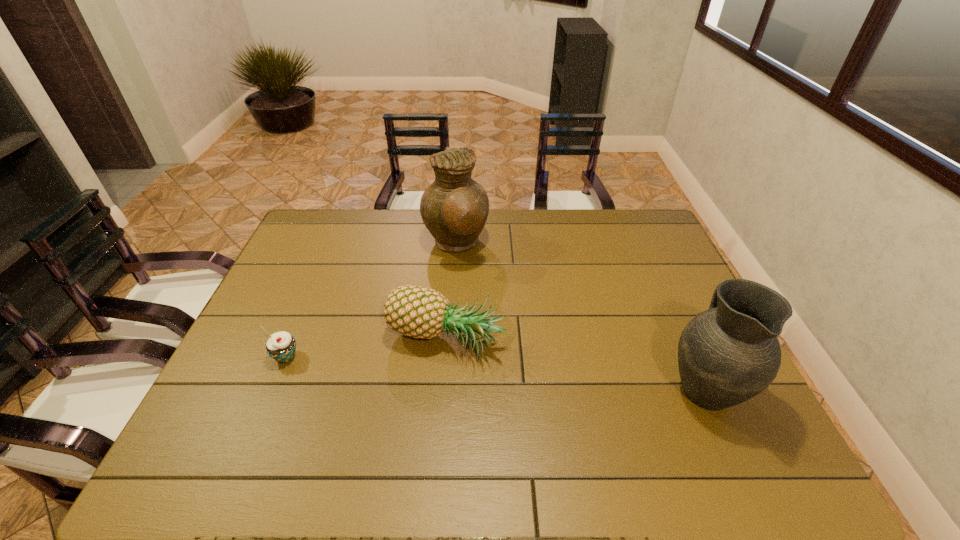
In the image, there is a desktop. At what (x,y) coordinates should I click in order to perform the action: click on blank space at the far right corner. Please return your answer as a coordinate pair (x, y). Looking at the image, I should click on (644, 219).

Locate an element on the screen. Image resolution: width=960 pixels, height=540 pixels. vacant area between the farther pitcher and the cupcake is located at coordinates (371, 301).

At what (x,y) coordinates should I click in order to perform the action: click on free area in between the cupcake and the farthest object. Please return your answer as a coordinate pair (x, y). Looking at the image, I should click on (371, 301).

Where is `vacant point located between the pineapple and the left pitcher`? vacant point located between the pineapple and the left pitcher is located at coordinates (451, 293).

Locate an element on the screen. Image resolution: width=960 pixels, height=540 pixels. empty space that is in between the nearer pitcher and the farthest object is located at coordinates click(x=580, y=316).

Where is `empty location between the rightmost object and the left pitcher`? This screenshot has height=540, width=960. empty location between the rightmost object and the left pitcher is located at coordinates (580, 316).

Locate an element on the screen. The width and height of the screenshot is (960, 540). free space that is in between the third tallest object and the nearer pitcher is located at coordinates (575, 365).

Image resolution: width=960 pixels, height=540 pixels. In order to click on vacant area between the cupcake and the nearer pitcher in this screenshot , I will do `click(495, 373)`.

I want to click on empty space that is in between the right pitcher and the pineapple, so pyautogui.click(x=575, y=365).

You are a GUI agent. You are given a task and a screenshot of the screen. Output one action in this format:
    pyautogui.click(x=<x>, y=<y>)
    Task: Click on the vacant area that lies between the left pitcher and the leftmost object
    
    Given the screenshot: What is the action you would take?
    pyautogui.click(x=371, y=301)